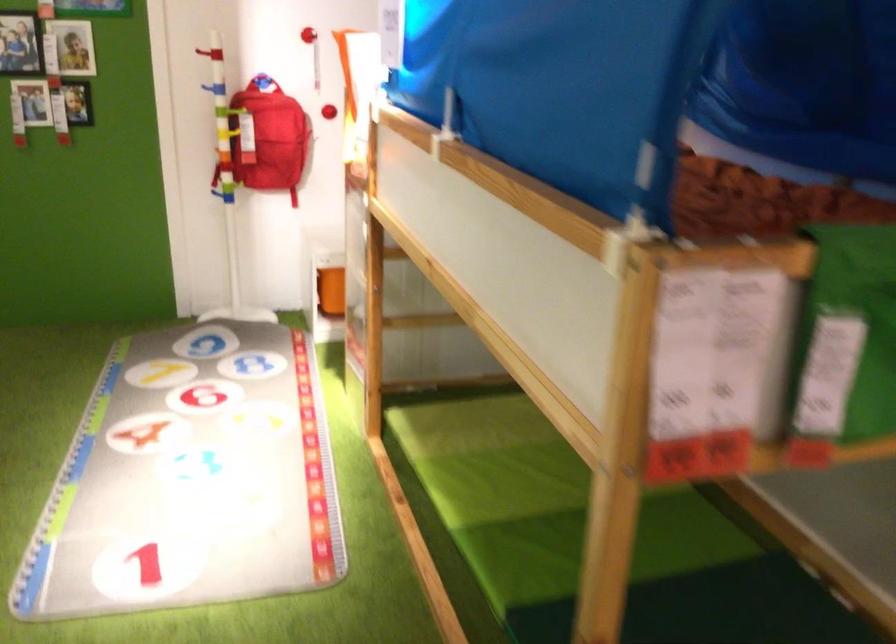
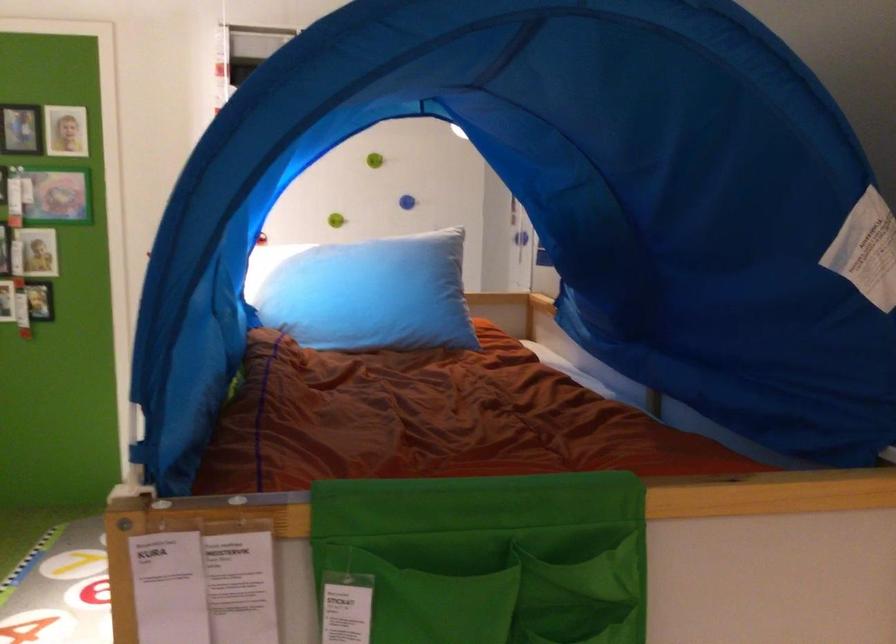
In the second image, find the point that corresponds to pixel 73 84 in the first image.

(39, 301)